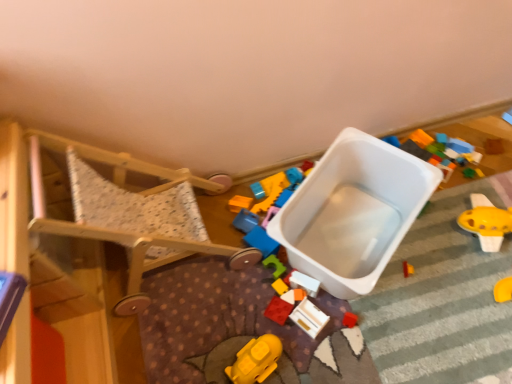
This screenshot has width=512, height=384. Identify the location of space that is in front of rubberized red block at center, which is counted as the second toy, starting from the left. (301, 354).